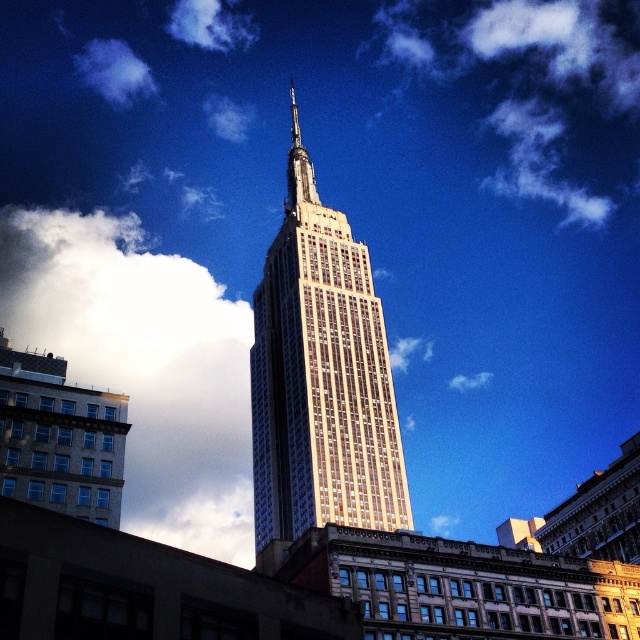
What do you see at coordinates (321, 378) in the screenshot? I see `gold glass tower at center` at bounding box center [321, 378].

Does gold glass tower at center have a lesser height compared to white fluffy cloud at upper center?

Incorrect, gold glass tower at center's height does not fall short of white fluffy cloud at upper center's.

Between point (304, 470) and point (476, 376), which one is positioned behind?

Positioned behind is point (476, 376).

Locate an element on the screen. gold glass tower at center is located at coordinates (321, 378).

Which is in front, point (332, 246) or point (141, 88)?

Positioned in front is point (332, 246).

Does gold glass tower at center have a larger size compared to white fluffy cloud at upper left?

Indeed, gold glass tower at center has a larger size compared to white fluffy cloud at upper left.

Looking at this image, who is more forward, (289, 518) or (122, 100)?

Point (289, 518)

Where is `gold glass tower at center`? The height and width of the screenshot is (640, 640). gold glass tower at center is located at coordinates (321, 378).

Which of these two, gold glass tower at center or shiny silver spire at center, stands taller?

With more height is gold glass tower at center.

Is gold glass tower at center to the right of shiny silver spire at center from the viewer's perspective?

Yes, gold glass tower at center is to the right of shiny silver spire at center.

The image size is (640, 640). I want to click on gold glass tower at center, so click(x=321, y=378).